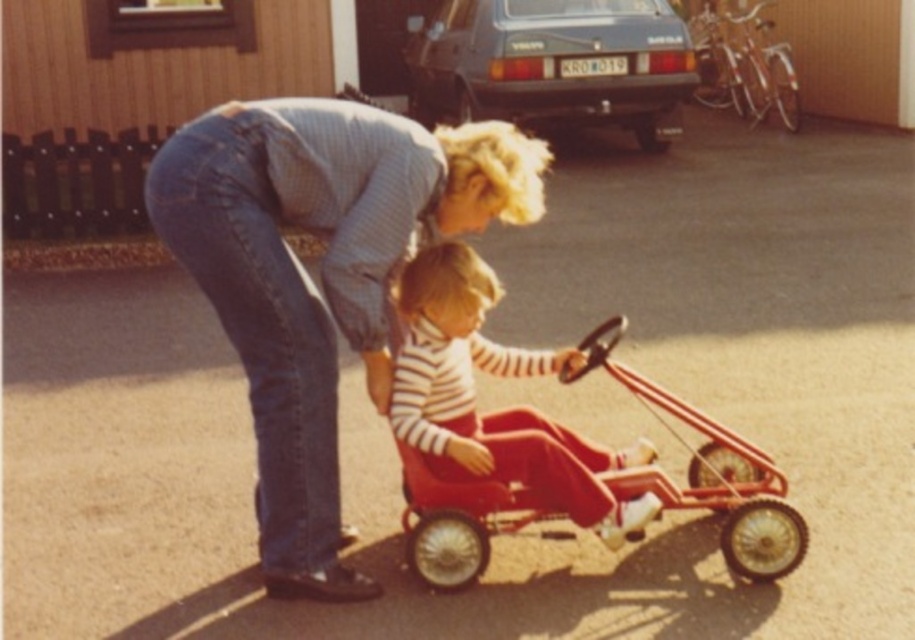
Question: Among these objects, which one is farthest from the camera?

Choices:
 (A) metallic red toy car at center
 (B) denim jeans at center
 (C) matte black car at upper center

Answer: (C)

Question: Is denim jeans at center positioned in front of striped fabric toddler at center?

Choices:
 (A) yes
 (B) no

Answer: (A)

Question: Among these points, which one is nearest to the camera?

Choices:
 (A) (454, 90)
 (B) (651, 387)

Answer: (B)

Question: Does denim jeans at center have a lesser width compared to striped fabric toddler at center?

Choices:
 (A) yes
 (B) no

Answer: (B)

Question: Which object appears farthest from the camera in this image?

Choices:
 (A) metallic red toy car at center
 (B) matte black car at upper center
 (C) striped fabric toddler at center
 (D) denim jeans at center

Answer: (B)

Question: Does denim jeans at center appear under matte black car at upper center?

Choices:
 (A) no
 (B) yes

Answer: (B)